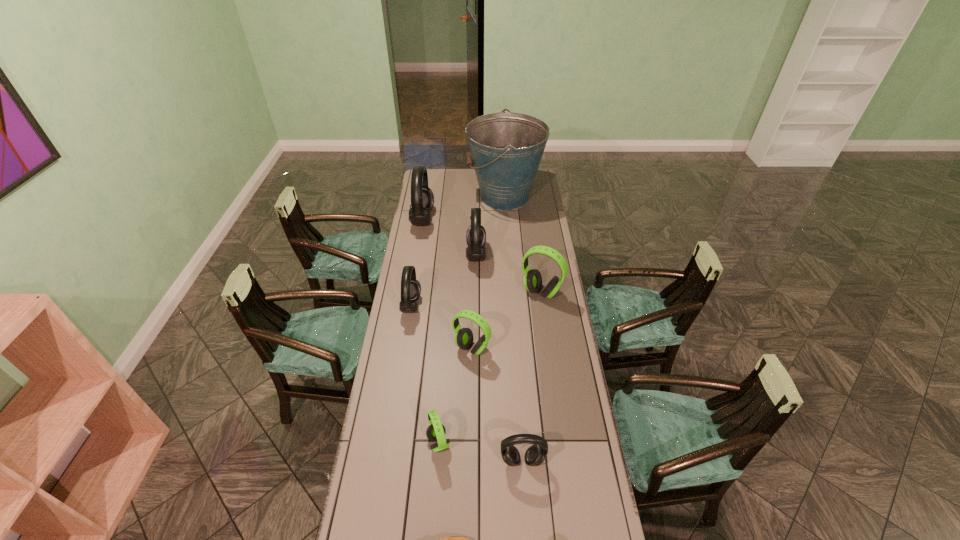
The width and height of the screenshot is (960, 540). What are the coordinates of `gray headset that stands as the second closest to the bucket` in the screenshot? It's located at (422, 198).

Select which green headset is the closest to the second smallest gray headset. Please provide its 2D coordinates. Your answer should be formatted as a tuple, i.e. [(x, y)], where the tuple contains the x and y coordinates of a point satisfying the conditions above.

[(464, 337)]

Where is `the closest green headset relative to the smallest green headset`? the closest green headset relative to the smallest green headset is located at coordinates (464, 337).

What are the coordinates of `free space that satisfies the following two spatial constraints: 1. on the back side of the farthest green headset; 2. on the left side of the smallest green headset` in the screenshot? It's located at (449, 292).

Identify the location of vacant space that satisfies the following two spatial constraints: 1. on the back side of the rightmost green headset; 2. on the earcups of the tallest headset. Image resolution: width=960 pixels, height=540 pixels. (531, 219).

Where is `blank area in the image that satisfies the following two spatial constraints: 1. on the earcups of the tallest headset; 2. on the left side of the smallest green headset`? Image resolution: width=960 pixels, height=540 pixels. blank area in the image that satisfies the following two spatial constraints: 1. on the earcups of the tallest headset; 2. on the left side of the smallest green headset is located at coordinates (387, 443).

Image resolution: width=960 pixels, height=540 pixels. In order to click on vacant region that satisfies the following two spatial constraints: 1. on the earcups of the smallest green headset; 2. on the right side of the second smallest gray headset in this screenshot , I will do `click(391, 443)`.